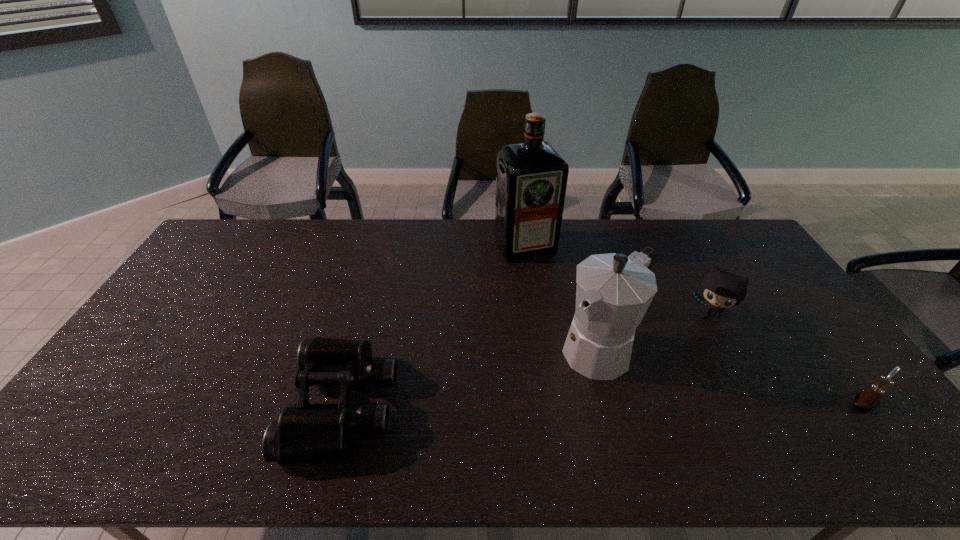
Identify the location of binoculars. (305, 432).

Locate an element on the screen. The image size is (960, 540). the rightmost object is located at coordinates (867, 400).

Find the location of `the fourth object from left to right`. the fourth object from left to right is located at coordinates (721, 289).

Where is `the third shortest object`? This screenshot has height=540, width=960. the third shortest object is located at coordinates (721, 289).

The image size is (960, 540). In order to click on coffeepot in this screenshot , I will do `click(613, 293)`.

Where is `the farthest object`? The width and height of the screenshot is (960, 540). the farthest object is located at coordinates (531, 178).

Where is `liquor`? Image resolution: width=960 pixels, height=540 pixels. liquor is located at coordinates (531, 178).

The height and width of the screenshot is (540, 960). In order to click on blank space located on the front-facing side of the leftmost object in this screenshot , I will do `click(138, 405)`.

Image resolution: width=960 pixels, height=540 pixels. Find the location of `vacant region located 0.180m on the front-facing side of the leftmost object`. vacant region located 0.180m on the front-facing side of the leftmost object is located at coordinates (222, 405).

Find the location of a particular element. Image resolution: width=960 pixels, height=540 pixels. vacant space located 0.250m on the front-facing side of the leftmost object is located at coordinates (194, 405).